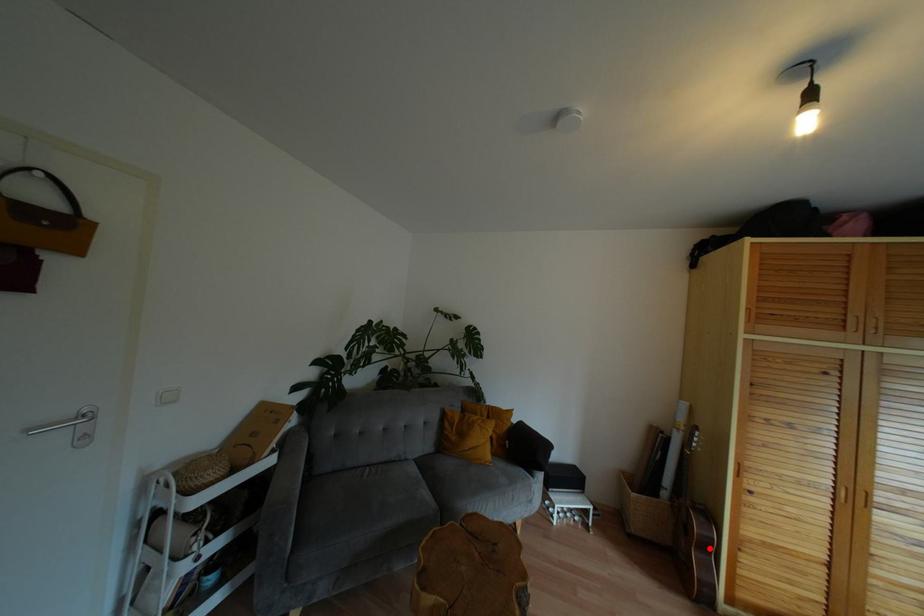
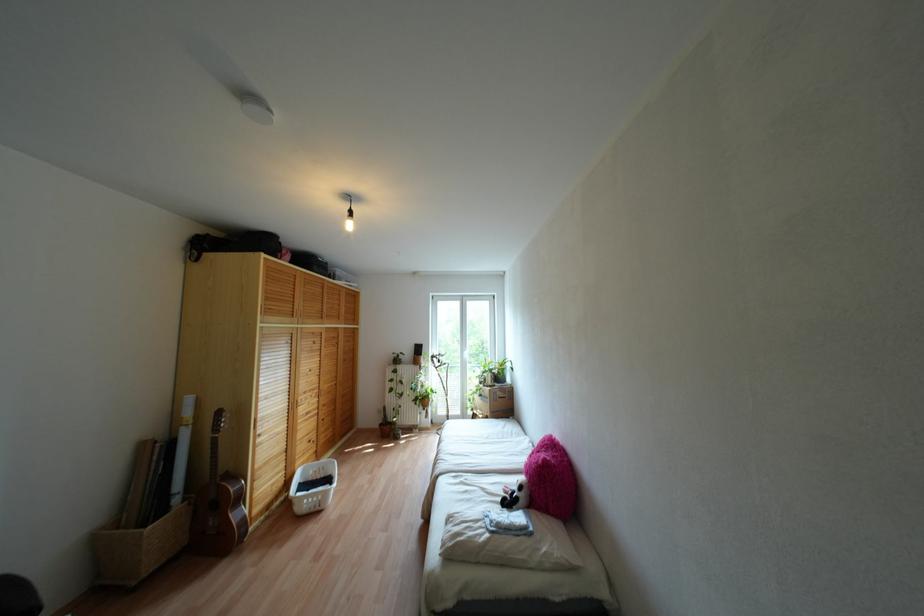
Question: I am providing you with two images of the same scene from different viewpoints. Given a red point in image1, look at the same physical point in image2. Is it:

Choices:
 (A) Closer to the viewpoint
 (B) Farther from the viewpoint

Answer: (B)